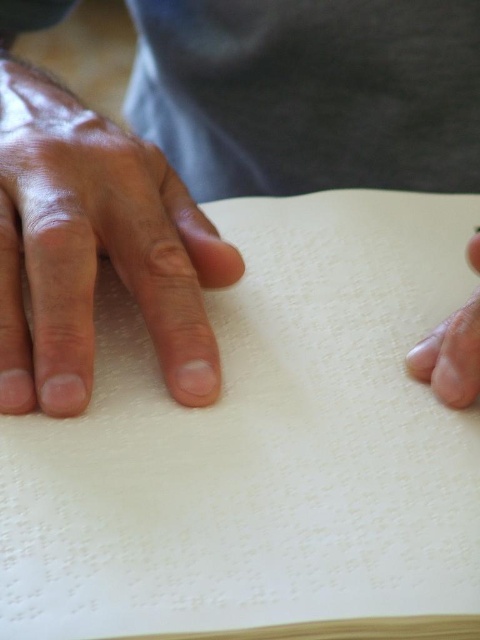
Who is positioned more to the left, white paper at center or smooth skin at lower right?

From the viewer's perspective, white paper at center appears more on the left side.

What do you see at coordinates (261, 444) in the screenshot? I see `white paper at center` at bounding box center [261, 444].

Is point (218, 342) behind point (443, 387)?

Yes, point (218, 342) is farther from viewer.

Locate an element on the screen. Image resolution: width=480 pixels, height=640 pixels. white paper at center is located at coordinates (261, 444).

Is smooth paper at center bigger than smooth skin at lower right?

Yes.

Is smooth paper at center positioned at the back of smooth skin at lower right?

Yes, it is.

The width and height of the screenshot is (480, 640). What do you see at coordinates (208, 161) in the screenshot?
I see `smooth paper at center` at bounding box center [208, 161].

Locate an element on the screen. This screenshot has height=640, width=480. smooth paper at center is located at coordinates (208, 161).

Between white paper at center and smooth paper at center, which one appears on the left side from the viewer's perspective?

Positioned to the left is smooth paper at center.

Who is positioned more to the right, white paper at center or smooth paper at center?

white paper at center is more to the right.

Where is `white paper at center`? This screenshot has height=640, width=480. white paper at center is located at coordinates (261, 444).

This screenshot has width=480, height=640. I want to click on white paper at center, so click(261, 444).